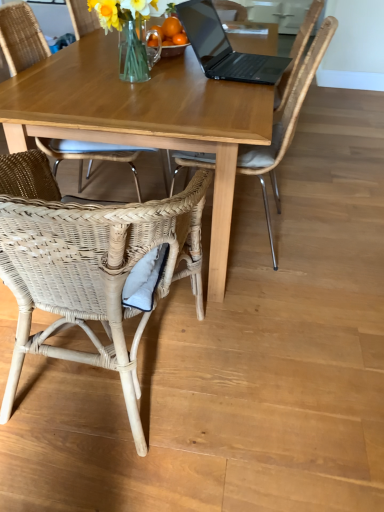
Where is `free space to the left of black matte laptop at upper center`? The height and width of the screenshot is (512, 384). free space to the left of black matte laptop at upper center is located at coordinates (148, 65).